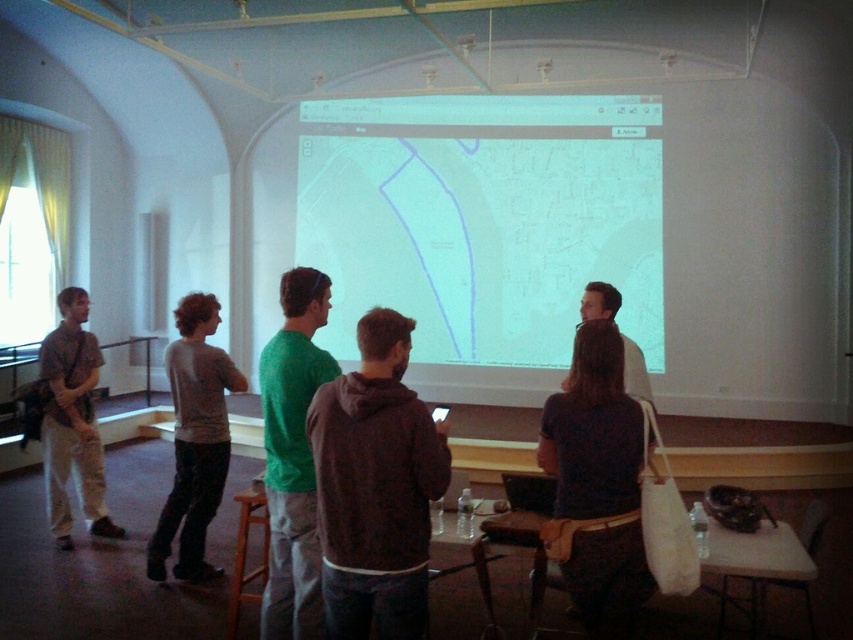
Is dark brown hoodie at center smaller than dark blue shirt at center?

Yes.

Who is taller, dark brown hoodie at center or dark blue shirt at center?

With more height is dark brown hoodie at center.

What are the coordinates of `dark brown hoodie at center` in the screenshot? It's located at (375, 486).

Identify the location of dark brown hoodie at center. The height and width of the screenshot is (640, 853). (375, 486).

Is point (607, 588) positioned before point (177, 467)?

That is True.

Is dark blue shirt at center shorter than gray cotton sweater at center?

Yes, dark blue shirt at center is shorter than gray cotton sweater at center.

Is point (618, 346) positioned after point (204, 403)?

That is False.

This screenshot has height=640, width=853. What are the coordinates of `dark blue shirt at center` in the screenshot? It's located at pyautogui.click(x=592, y=433).

This screenshot has width=853, height=640. What do you see at coordinates (482, 218) in the screenshot? I see `white matte projection screen at center` at bounding box center [482, 218].

Between point (335, 212) and point (595, 600), which one is positioned in front?

Point (595, 600)

Does point (531, 248) come closer to viewer compared to point (636, 413)?

No, it is behind (636, 413).

Identify the location of white matte projection screen at center. [482, 218].